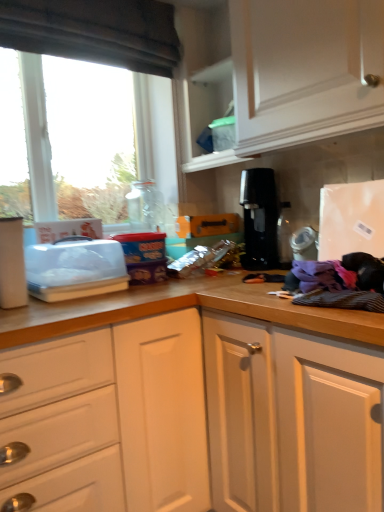
Question: Can you confirm if clear plastic container at left is smaller than dark fabric exhaust hood at upper left?

Choices:
 (A) yes
 (B) no

Answer: (A)

Question: From the image's perspective, is clear plastic container at left below dark fabric exhaust hood at upper left?

Choices:
 (A) yes
 (B) no

Answer: (A)

Question: From a real-world perspective, is clear plastic container at left below dark fabric exhaust hood at upper left?

Choices:
 (A) yes
 (B) no

Answer: (A)

Question: Considering the relative sizes of clear plastic container at left and dark fabric exhaust hood at upper left in the image provided, is clear plastic container at left shorter than dark fabric exhaust hood at upper left?

Choices:
 (A) no
 (B) yes

Answer: (B)

Question: From a real-world perspective, is clear plastic container at left over dark fabric exhaust hood at upper left?

Choices:
 (A) yes
 (B) no

Answer: (B)

Question: From the image's perspective, relative to transparent glass window at left, is dark fabric exhaust hood at upper left above or below?

Choices:
 (A) above
 (B) below

Answer: (A)

Question: Would you say dark fabric exhaust hood at upper left is inside or outside transparent glass window at left?

Choices:
 (A) outside
 (B) inside

Answer: (A)

Question: Is point (157, 35) closer or farther from the camera than point (137, 67)?

Choices:
 (A) closer
 (B) farther

Answer: (A)

Question: Considering the positions of dark fabric exhaust hood at upper left and transparent glass window at left in the image, is dark fabric exhaust hood at upper left taller or shorter than transparent glass window at left?

Choices:
 (A) tall
 (B) short

Answer: (B)

Question: Would you say transparent glass window at left is to the left or to the right of black plastic coffee machine at center in the picture?

Choices:
 (A) right
 (B) left

Answer: (B)

Question: Is transparent glass window at left taller or shorter than black plastic coffee machine at center?

Choices:
 (A) short
 (B) tall

Answer: (B)

Question: From a real-world perspective, is transparent glass window at left above or below black plastic coffee machine at center?

Choices:
 (A) above
 (B) below

Answer: (A)

Question: Considering their positions, is transparent glass window at left located in front of or behind black plastic coffee machine at center?

Choices:
 (A) front
 (B) behind

Answer: (B)

Question: From the image's perspective, relative to clear plastic container at left, is black plastic coffee machine at center above or below?

Choices:
 (A) above
 (B) below

Answer: (A)

Question: Relative to clear plastic container at left, is black plastic coffee machine at center in front or behind?

Choices:
 (A) front
 (B) behind

Answer: (B)